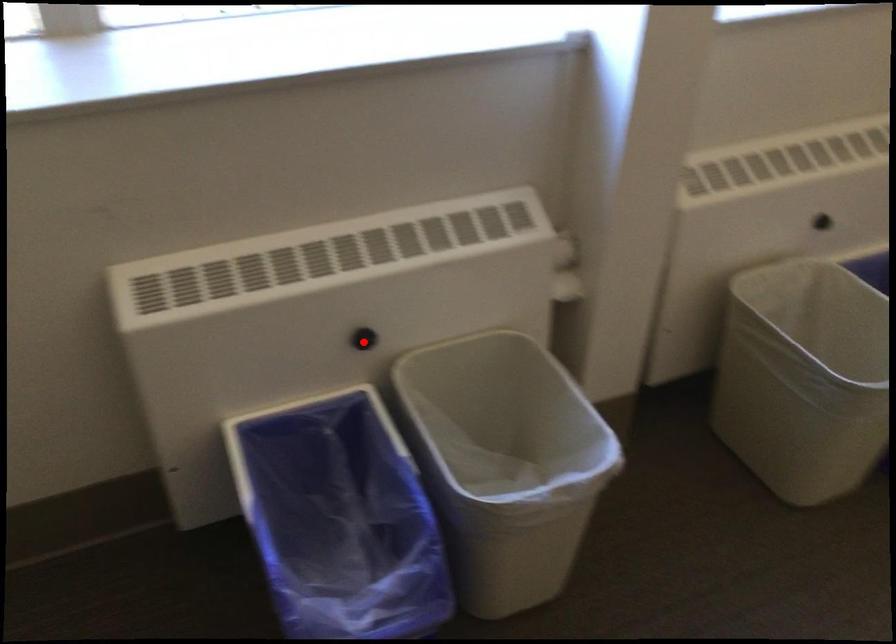
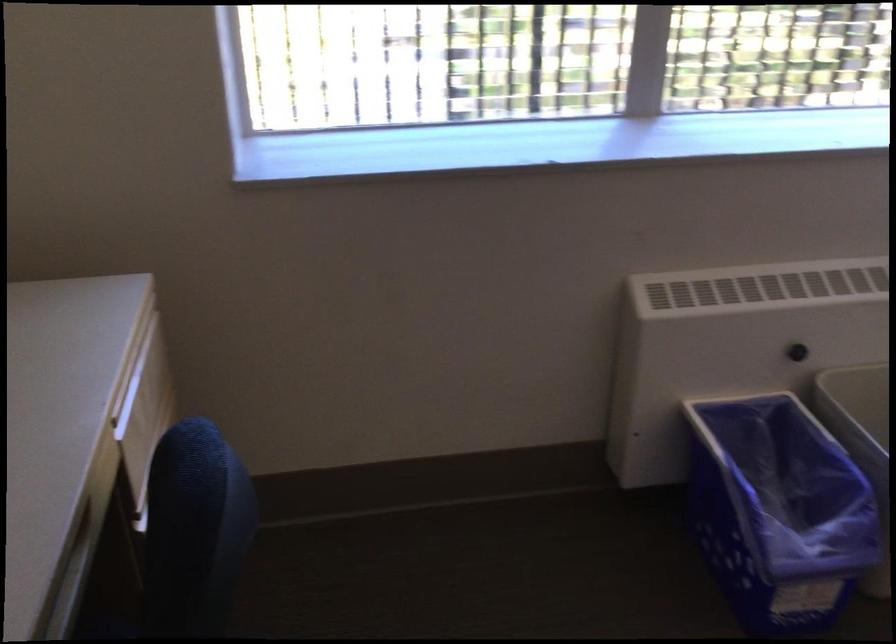
Where in the second image is the point corresponding to the highlighted location from the first image?

(796, 352)